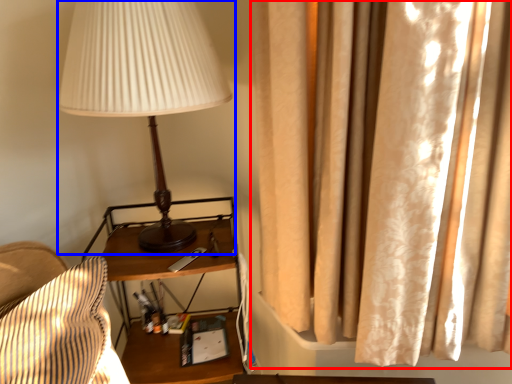
Question: Which point is further to the camera, curtain (highlighted by a red box) or lamp (highlighted by a blue box)?

Choices:
 (A) curtain
 (B) lamp

Answer: (B)